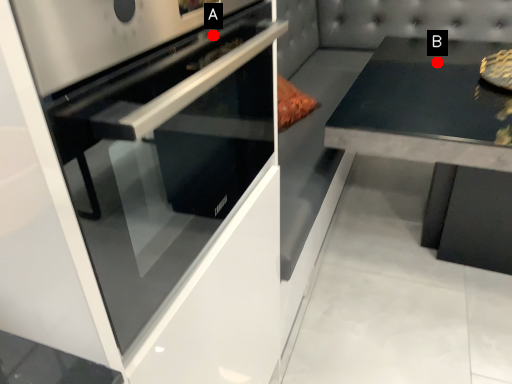
Question: Two points are circled on the image, labeled by A and B beside each circle. Which point is farther to the camera?

Choices:
 (A) A is further
 (B) B is further

Answer: (B)